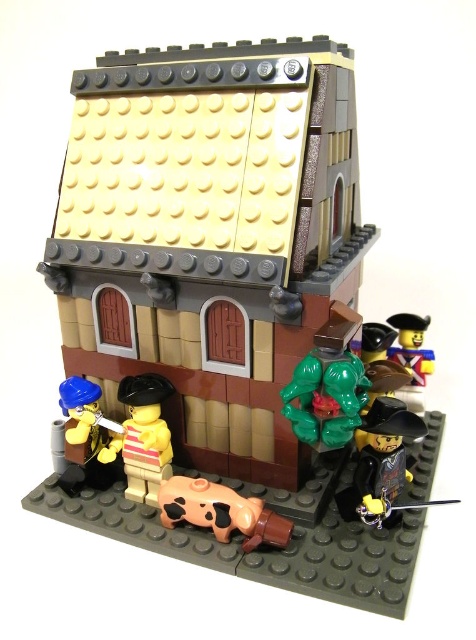
You are a LEGO architect designing a new set. You need to ensure that the brown matte cow at lower center and the yellow matte minifigure at upper right fit within the display area. Which object is shorter and therefore easier to accommodate vertically?

The brown matte cow at lower center is shorter than the yellow matte minifigure at upper right, making it easier to accommodate vertically.

You are a delivery robot trying to reach the brown matte cow at lower center. There is a green rubber figure at center blocking your path. Can you go around it to reach the cow?

The green rubber figure at center is in front of the brown matte cow at lower center, so you can go around it to reach the cow as long as there is space on the sides.

You are a delivery drone trying to land on the LEGO building. The landing pad is at point 0.5, 0.5. Which direction should you move relative to the green rubber figure at center to reach the landing pad?

The green rubber figure at center is located at point (327, 385). The landing pad is at (238, 320). To reach the landing pad, you should move southwest relative to the green rubber figure at center because the landing pad is southwest of its current position.